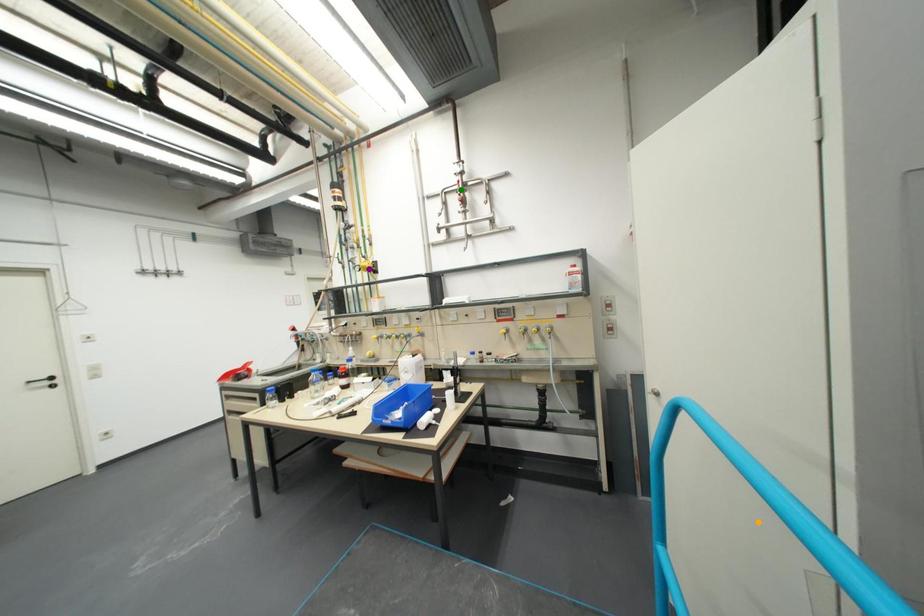
Order these from nearest to farthest:
1. purple point
2. orange point
3. green point

orange point → green point → purple point